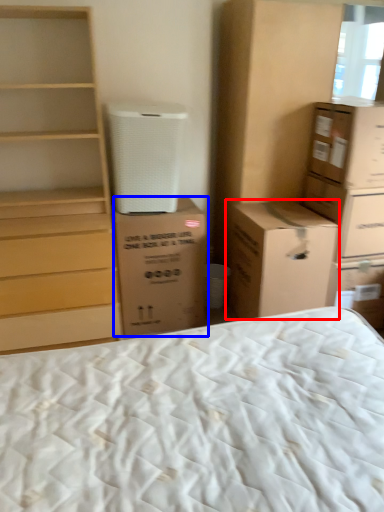
Question: Which object appears farthest to the camera in this image, cardboard box (highlighted by a red box) or cardboard box (highlighted by a blue box)?

Choices:
 (A) cardboard box
 (B) cardboard box

Answer: (B)